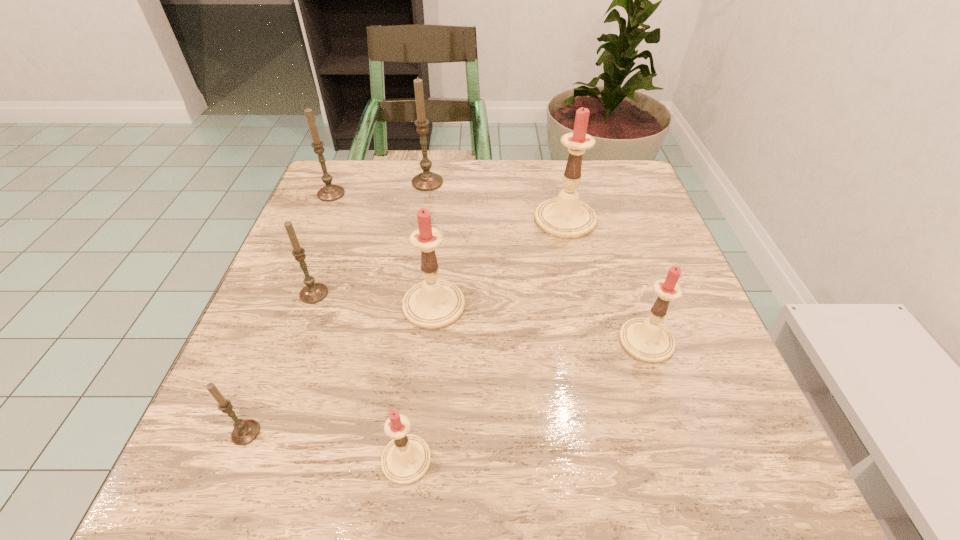
In order to click on the rightmost gray candle in this screenshot , I will do `click(426, 181)`.

At what (x,y) coordinates should I click in order to perform the action: click on the farthest red candle. Please return your answer as a coordinate pair (x, y). Image resolution: width=960 pixels, height=540 pixels. Looking at the image, I should click on (566, 217).

Image resolution: width=960 pixels, height=540 pixels. In order to click on the third smallest gray candle in this screenshot , I will do `click(330, 192)`.

The height and width of the screenshot is (540, 960). I want to click on the second biggest red candle, so click(x=432, y=304).

The height and width of the screenshot is (540, 960). What are the coordinates of `the third farthest gray candle` in the screenshot? It's located at (313, 292).

Locate an element on the screen. the second smallest red candle is located at coordinates (646, 339).

Image resolution: width=960 pixels, height=540 pixels. In order to click on the nearest gray candle in this screenshot , I will do `click(245, 431)`.

Where is `the nearest red candle`? Image resolution: width=960 pixels, height=540 pixels. the nearest red candle is located at coordinates click(x=405, y=459).

The image size is (960, 540). I want to click on vacant region located 0.120m on the right of the rightmost gray candle, so click(x=490, y=183).

Identify the location of free space located 0.340m on the front of the farthest red candle. (598, 368).